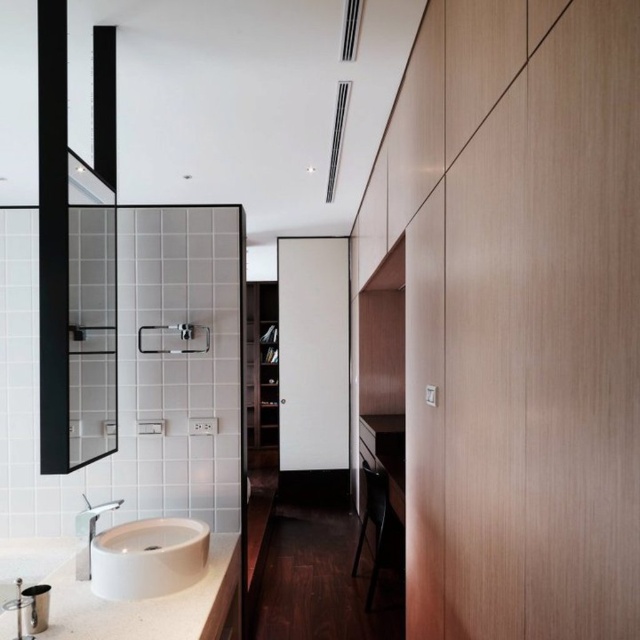
You are trying to clean the bathroom and need to reach both the white matte countertop at lower left and the white glossy sink at lower left. Which one should you clean first if you want to start from the lowest point?

A: The white matte countertop at lower left should be cleaned first since it is positioned below the white glossy sink at lower left, making it the lower of the two.

You are standing in the bathroom and need to reach a point in the workspace area. The two points you see are point (x=93, y=275) and point (x=193, y=579). Which point is closer to you?

Point (x=93, y=275) is behind point (x=193, y=579), so the closer point to you is point (x=193, y=579).

You are standing at the point marked as point [102,259]. You want to place a 2.5 meter long sofa in the workspace area. Can you fit it horizontally in the space between the desk and the wall?

The distance between the desk and the wall is 2.43 meters, which is slightly shorter than the 2.5 meter sofa. Therefore, the sofa cannot be placed horizontally in that space.